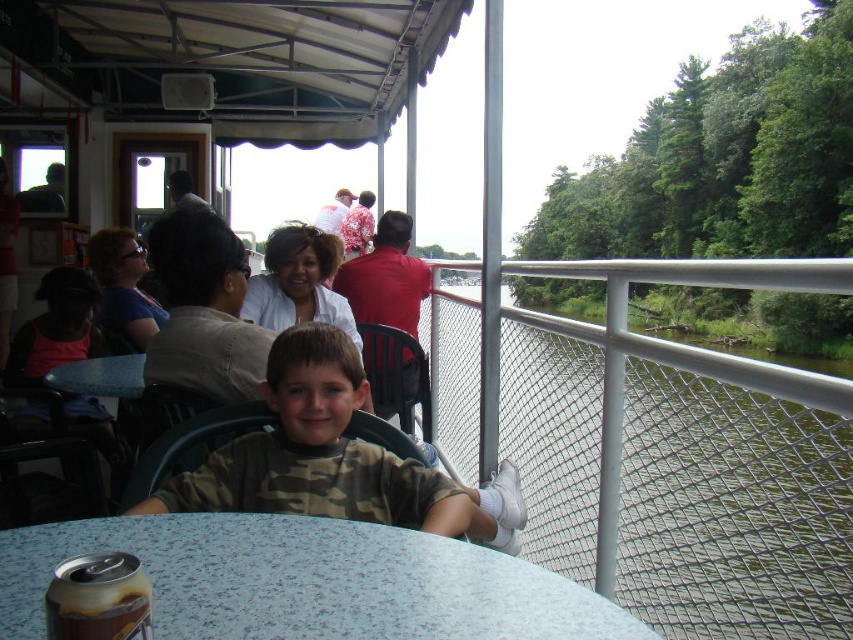
You are a photographer setting up a shoot at the riverside restaurant. You need to place a large camera tripod between the speckled plastic table at lower center and the blue fabric table at lower center. Which table should the tripod be placed closer to in order to avoid blocking the view of the blue fabric table?

The tripod should be placed closer to the speckled plastic table at lower center because it is in front of the blue fabric table at lower center, so positioning the tripod near the front table would minimize obstruction of the blue fabric table.

You are a photographer trying to capture a clear shot of the camouflage fabric shirt at center and the blue fabric table at lower center. Which object should you focus on first to ensure both are in focus?

The camouflage fabric shirt at center is closer to the viewer than the blue fabric table at lower center. To ensure both are in focus, you should focus on the camouflage fabric shirt at center first, as it is closer, and then adjust for the blue fabric table at lower center.

You are a waiter at the riverside restaurant and need to deliver a drink to the customer seated at the table with the metallic silver soda can at lower left. The table coordinates are at point 0.936, 0.116. What is the exact location of the table where you should place the drink?

The exact location to place the drink is at the table with the metallic silver soda can at lower left, which is located at coordinates point (97,598).